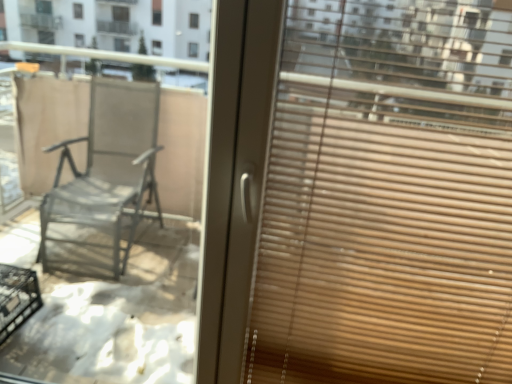
Question: Is matte glass window at center bigger or smaller than wooden blinds at right?

Choices:
 (A) small
 (B) big

Answer: (A)

Question: Considering the positions of matte glass window at center and wooden blinds at right in the image, is matte glass window at center taller or shorter than wooden blinds at right?

Choices:
 (A) short
 (B) tall

Answer: (B)

Question: Visually, is matte glass window at center positioned to the left or to the right of wooden blinds at right?

Choices:
 (A) left
 (B) right

Answer: (A)

Question: Visually, is wooden blinds at right positioned to the left or to the right of matte glass window at center?

Choices:
 (A) left
 (B) right

Answer: (B)

Question: In terms of size, does wooden blinds at right appear bigger or smaller than matte glass window at center?

Choices:
 (A) small
 (B) big

Answer: (B)

Question: Is wooden blinds at right wider or thinner than matte glass window at center?

Choices:
 (A) wide
 (B) thin

Answer: (A)

Question: Considering the positions of point (339, 147) and point (68, 312), is point (339, 147) closer or farther from the camera than point (68, 312)?

Choices:
 (A) farther
 (B) closer

Answer: (B)